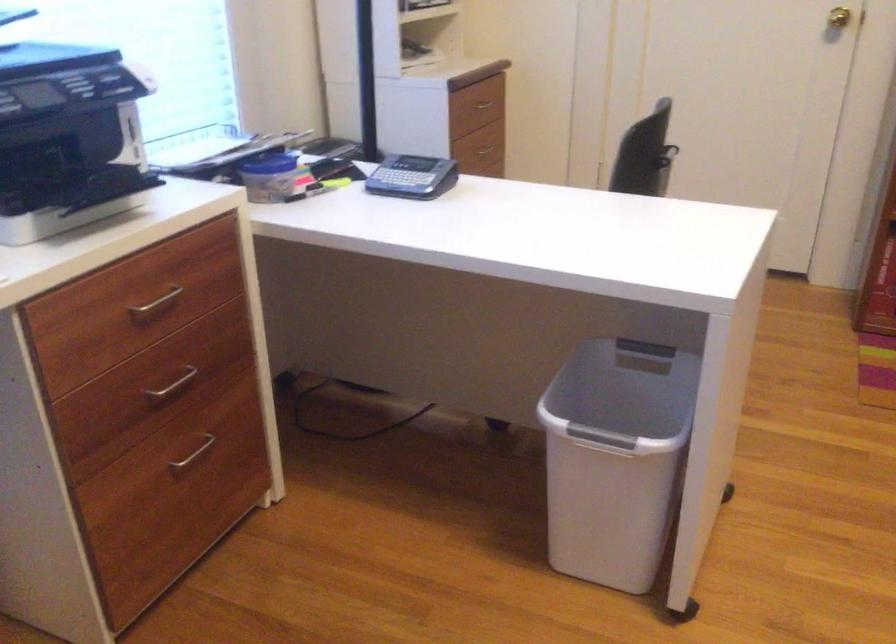
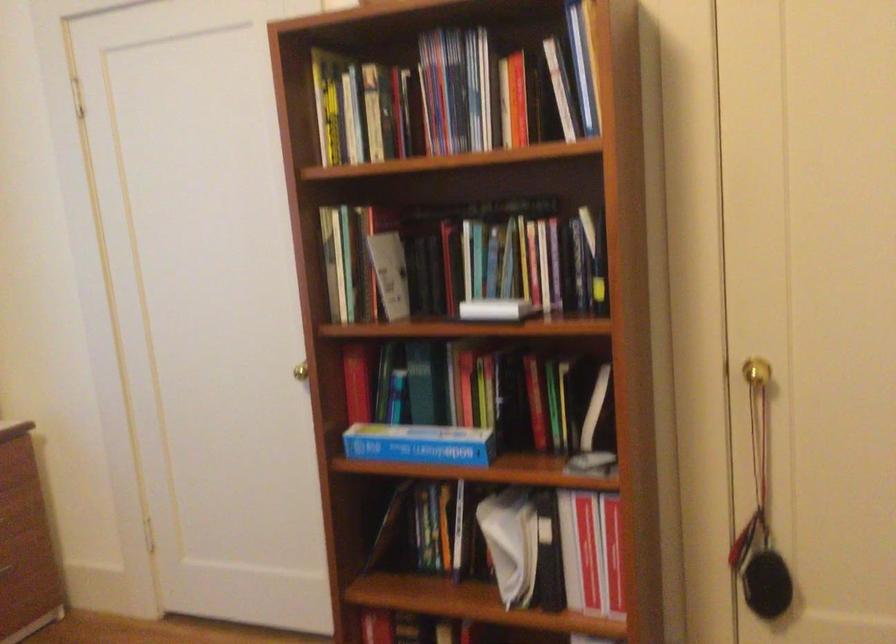
Question: I am providing you with two images of the same scene from different viewpoints. Please identify which objects are invisible in image2.

Choices:
 (A) butternut squash
 (B) brass doorknob
 (C) blue cardboard box
 (D) gold doorknob

Answer: (B)